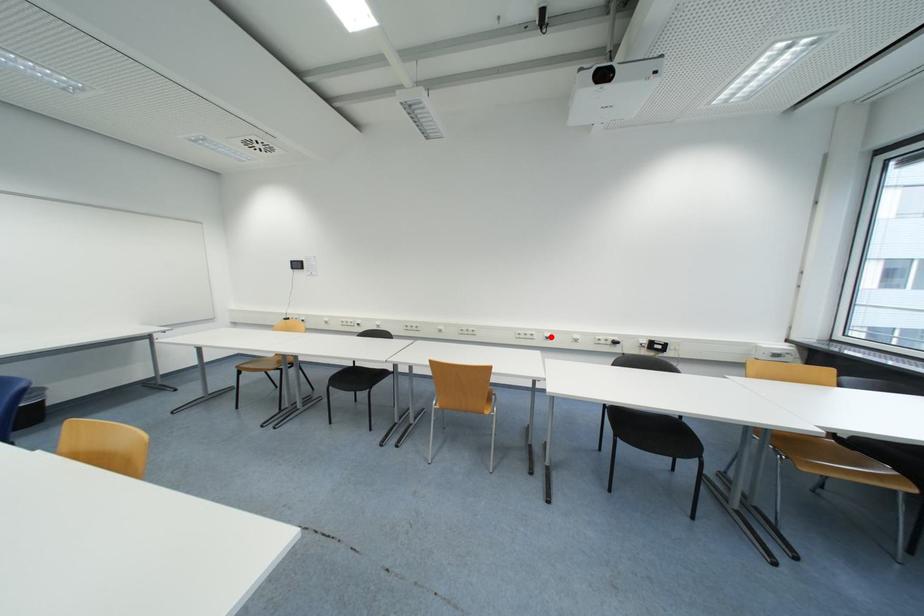
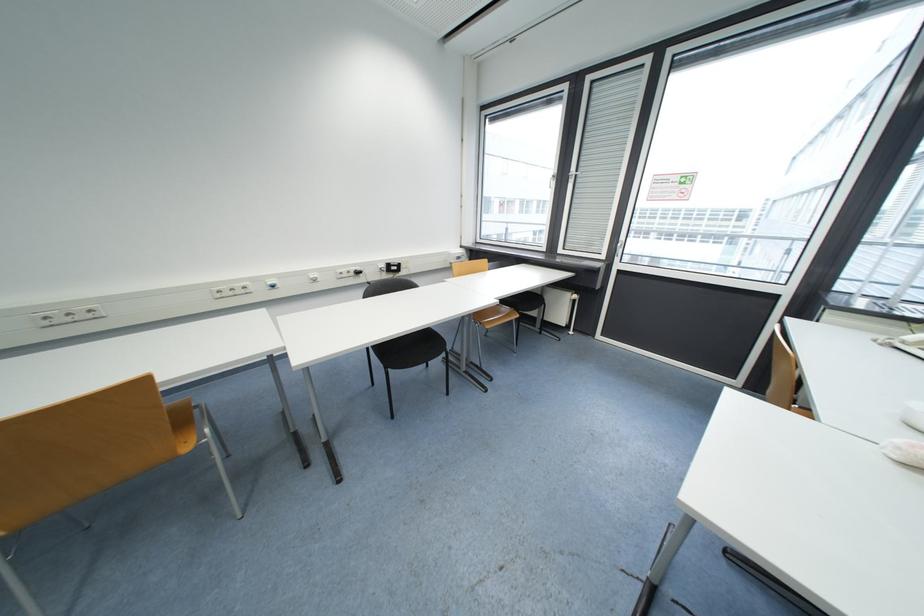
Find the pixel in the second image that matches the highlighted location in the first image.

(274, 285)